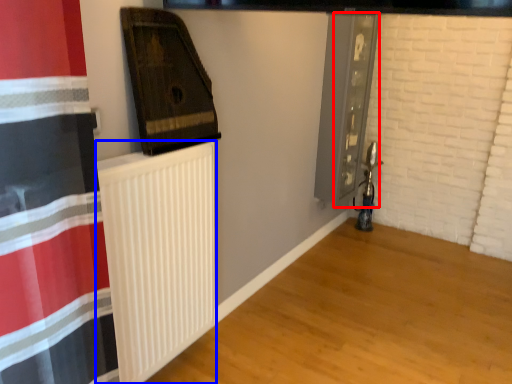
Question: Which object appears farthest to the camera in this image, screen door (highlighted by a red box) or radiator (highlighted by a blue box)?

Choices:
 (A) screen door
 (B) radiator

Answer: (A)